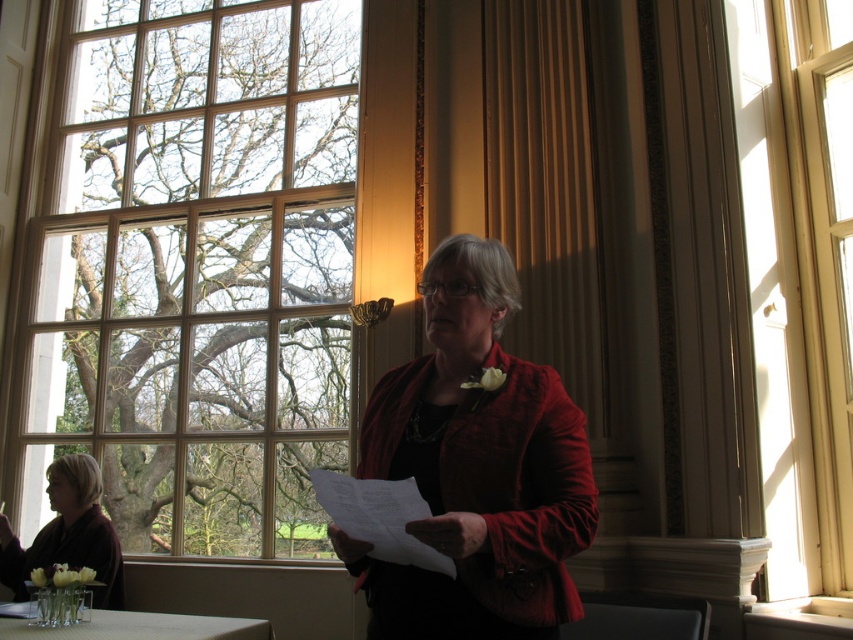
Does matte red jacket at center have a larger size compared to white paper at center?

Yes, matte red jacket at center is bigger than white paper at center.

Looking at this image, does matte red jacket at center have a smaller size compared to white paper at center?

Incorrect, matte red jacket at center is not smaller in size than white paper at center.

Which is behind, point (509, 296) or point (379, 488)?

Point (509, 296)

Where is `matte red jacket at center`? This screenshot has height=640, width=853. matte red jacket at center is located at coordinates (476, 468).

Does wooden frame window at right have a larger size compared to white paper at center?

Correct, wooden frame window at right is larger in size than white paper at center.

What do you see at coordinates (799, 276) in the screenshot? I see `wooden frame window at right` at bounding box center [799, 276].

Where is `wooden frame window at right`? This screenshot has height=640, width=853. wooden frame window at right is located at coordinates (799, 276).

Image resolution: width=853 pixels, height=640 pixels. I want to click on clear glass window at upper left, so click(x=195, y=272).

Based on the photo, who is higher up, clear glass window at upper left or wooden frame window at right?

Positioned higher is wooden frame window at right.

Is point (223, 301) closer to camera compared to point (775, 124)?

No.

Find the location of `clear glass window at upper left`. clear glass window at upper left is located at coordinates (195, 272).